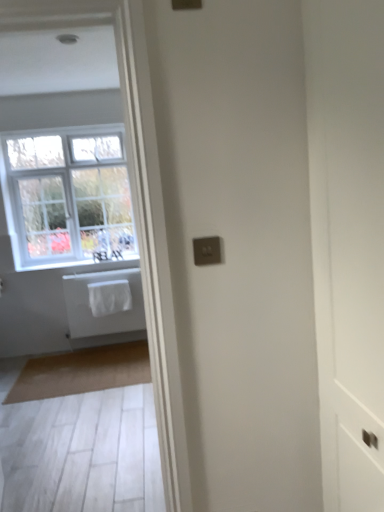
Question: Can you confirm if satin gold switchplate at center is thinner than white fabric laundry at center?

Choices:
 (A) yes
 (B) no

Answer: (A)

Question: Is satin gold switchplate at center far from white fabric laundry at center?

Choices:
 (A) yes
 (B) no

Answer: (A)

Question: Is satin gold switchplate at center closer to the viewer compared to white fabric laundry at center?

Choices:
 (A) no
 (B) yes

Answer: (B)

Question: Can you see satin gold switchplate at center touching white fabric laundry at center?

Choices:
 (A) yes
 (B) no

Answer: (B)

Question: From a real-world perspective, is satin gold switchplate at center below white fabric laundry at center?

Choices:
 (A) yes
 (B) no

Answer: (B)

Question: From the image's perspective, is satin gold switchplate at center above or below white matte towel at left?

Choices:
 (A) below
 (B) above

Answer: (B)

Question: From a real-world perspective, is satin gold switchplate at center physically located above or below white matte towel at left?

Choices:
 (A) below
 (B) above

Answer: (B)

Question: Is satin gold switchplate at center wider or thinner than white matte towel at left?

Choices:
 (A) wide
 (B) thin

Answer: (B)

Question: Based on their sizes in the image, would you say satin gold switchplate at center is bigger or smaller than white matte towel at left?

Choices:
 (A) small
 (B) big

Answer: (A)

Question: From a real-world perspective, is white fabric at lower left above or below white matte towel at left?

Choices:
 (A) below
 (B) above

Answer: (B)

Question: Is white fabric at lower left taller or shorter than white matte towel at left?

Choices:
 (A) tall
 (B) short

Answer: (B)

Question: Is white fabric at lower left wider or thinner than white matte towel at left?

Choices:
 (A) thin
 (B) wide

Answer: (B)

Question: Is point (86, 266) positioned closer to the camera than point (72, 311)?

Choices:
 (A) closer
 (B) farther

Answer: (B)

Question: Considering the positions of satin gold switchplate at center and white fabric laundry at center in the image, is satin gold switchplate at center wider or thinner than white fabric laundry at center?

Choices:
 (A) wide
 (B) thin

Answer: (B)

Question: From a real-world perspective, is satin gold switchplate at center above or below white fabric laundry at center?

Choices:
 (A) below
 (B) above

Answer: (B)